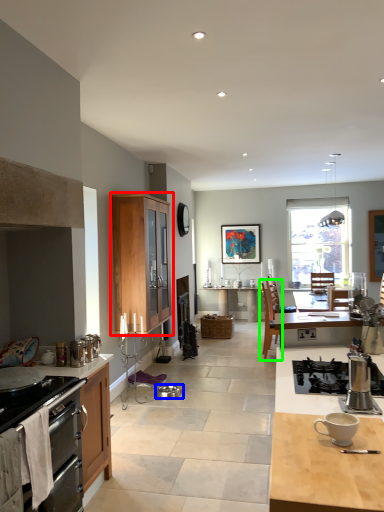
Question: Based on their relative distances, which object is nearer to cabinetry (highlighted by a red box)? Choose from kitchen appliance (highlighted by a blue box) and chair (highlighted by a green box).

Choices:
 (A) kitchen appliance
 (B) chair

Answer: (A)